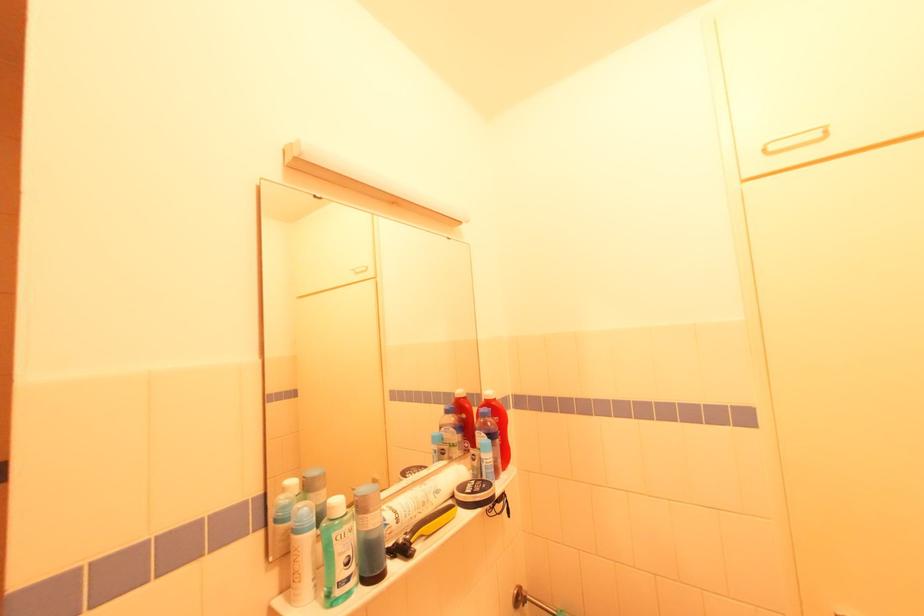
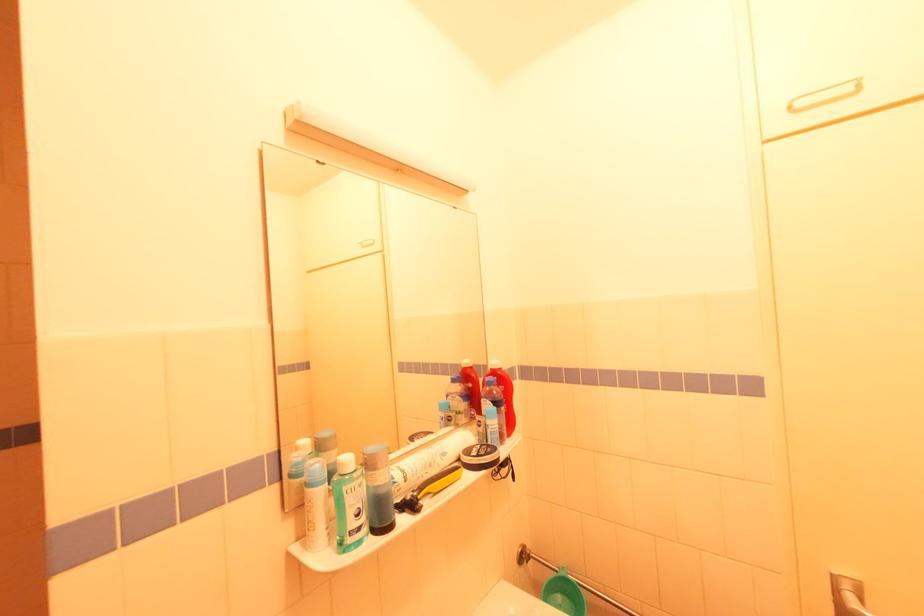
Question: What movement of the cameraman would produce the second image?

Choices:
 (A) Left
 (B) Right
 (C) Forward
 (D) Backward

Answer: (B)